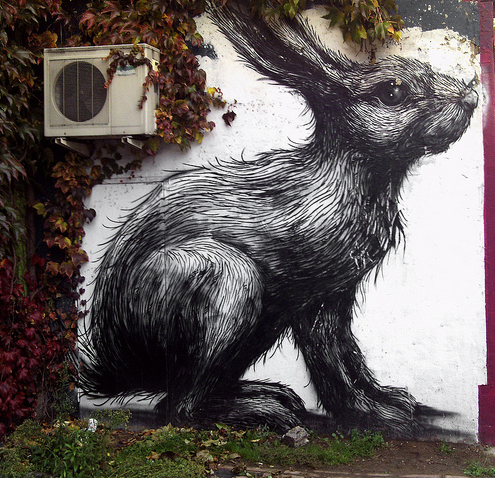
The height and width of the screenshot is (478, 495). Find the location of `wall`. wall is located at coordinates (266, 147).